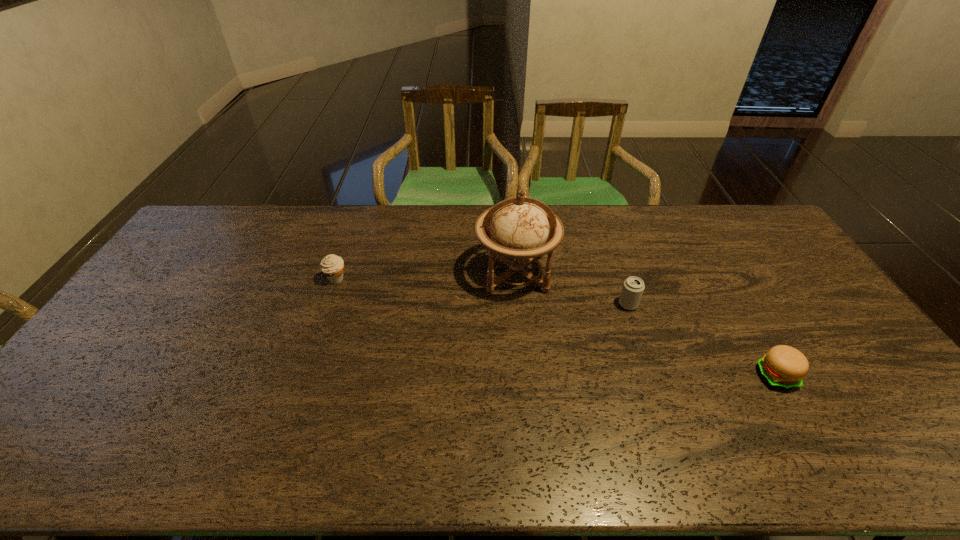
Find the location of a particular element. The height and width of the screenshot is (540, 960). blank space at the far edge of the desktop is located at coordinates (281, 210).

At what (x,y) coordinates should I click in order to perform the action: click on free space at the near edge. Please return your answer as a coordinate pair (x, y). The image size is (960, 540). Looking at the image, I should click on (147, 437).

In the image, there is a desktop. Identify the location of vacant space at the right edge. The height and width of the screenshot is (540, 960). (840, 337).

Image resolution: width=960 pixels, height=540 pixels. In order to click on blank space at the far left corner of the desktop in this screenshot , I will do `click(236, 216)`.

You are a GUI agent. You are given a task and a screenshot of the screen. Output one action in this format:
    pyautogui.click(x=<x>, y=<y>)
    Task: Click on the vacant position at the far right corner of the desktop
    
    Given the screenshot: What is the action you would take?
    pyautogui.click(x=722, y=216)

Where is `free space at the near right corner`? free space at the near right corner is located at coordinates (873, 447).

Where is `empty space that is in between the can and the rightmost object`? The height and width of the screenshot is (540, 960). empty space that is in between the can and the rightmost object is located at coordinates (702, 340).

Where is `free space between the hamburger and the leftmost object`? free space between the hamburger and the leftmost object is located at coordinates (556, 327).

At what (x,y) coordinates should I click in order to perform the action: click on free point between the globe and the nearest object. Please return your answer as a coordinate pair (x, y). Looking at the image, I should click on (646, 325).

Identify the location of free spot between the second object from left to right and the rightmost object. The image size is (960, 540). (646, 325).